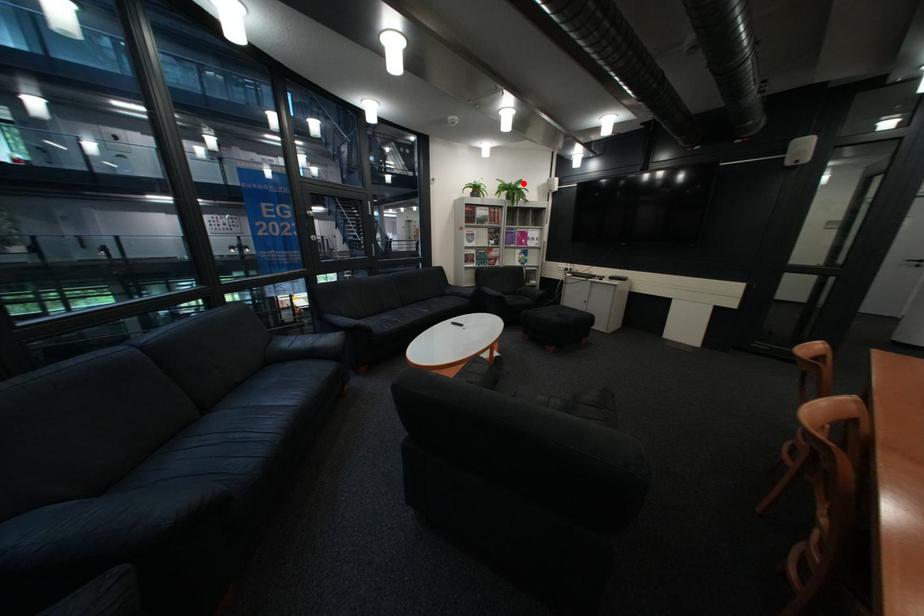
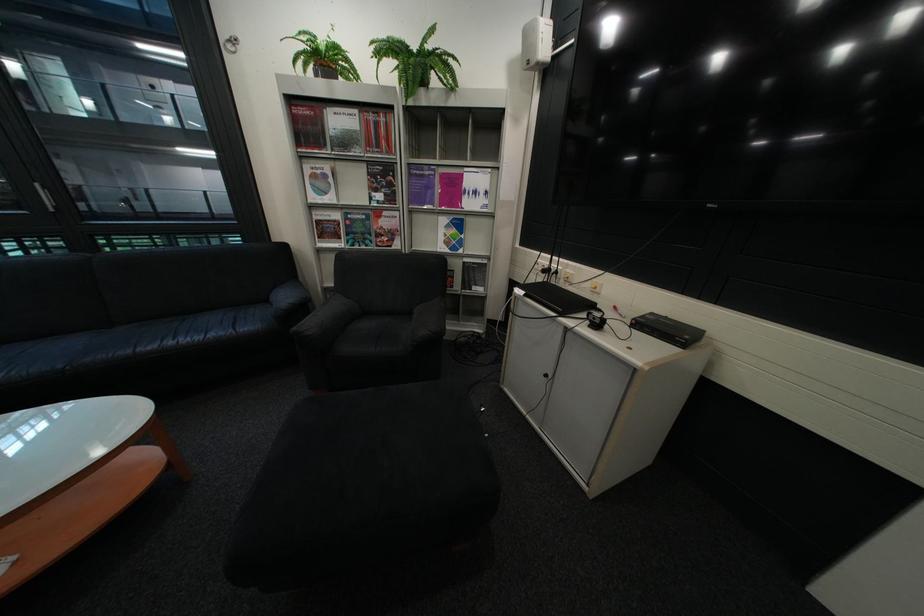
Find the pixel in the second image that matches the highlighted location in the first image.

(430, 46)